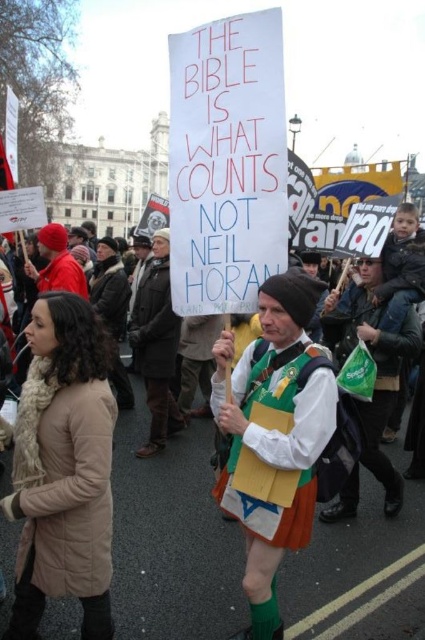
Question: Does white paper sign at center lie in front of brown leather jacket at center?

Choices:
 (A) yes
 (B) no

Answer: (A)

Question: Which point appears closest to the camera in this image?

Choices:
 (A) (152, 250)
 (B) (382, 332)
 (C) (240, 598)

Answer: (C)

Question: Does white paper sign at center lie in front of green fabric scarf at center?

Choices:
 (A) no
 (B) yes

Answer: (B)

Question: Does white paper sign at center appear under brown leather jacket at center?

Choices:
 (A) yes
 (B) no

Answer: (A)

Question: Considering the real-world distances, which object is farthest from the brown leather jacket at center?

Choices:
 (A) white paper sign at center
 (B) green fabric scarf at center

Answer: (B)

Question: Which point appears closest to the camera in this image?

Choices:
 (A) (408, 330)
 (B) (153, 348)
 (C) (166, 449)

Answer: (A)